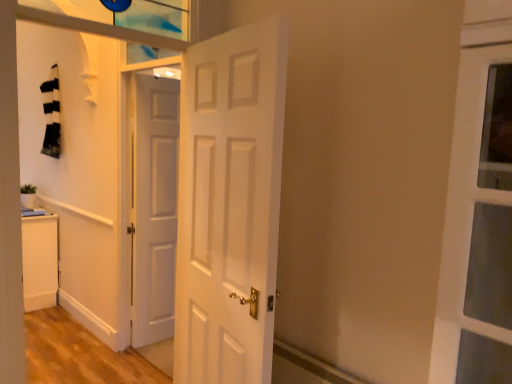
Question: Is white matte door at center, which is the 2th door in right-to-left order, bigger than white matte door at center, which is counted as the 1th door, starting from the front?

Choices:
 (A) yes
 (B) no

Answer: (B)

Question: Considering the relative positions of white matte door at center, the 1th door in the left-to-right sequence, and white matte door at center, the second door in the left-to-right sequence, in the image provided, is white matte door at center, the 1th door in the left-to-right sequence, to the right of white matte door at center, the second door in the left-to-right sequence, from the viewer's perspective?

Choices:
 (A) no
 (B) yes

Answer: (A)

Question: Considering the relative sizes of white matte door at center, the 1th door in the left-to-right sequence, and white matte door at center, the 1th door from the right, in the image provided, is white matte door at center, the 1th door in the left-to-right sequence, taller than white matte door at center, the 1th door from the right,?

Choices:
 (A) no
 (B) yes

Answer: (B)

Question: Is white matte door at center, which appears as the 1th door when viewed from the back, facing away from white matte door at center, the 1th door from the right?

Choices:
 (A) no
 (B) yes

Answer: (A)

Question: Does white matte door at center, which is the 2th door in right-to-left order, have a lesser height compared to white matte door at center, the 1th door from the right?

Choices:
 (A) no
 (B) yes

Answer: (A)

Question: Is white matte door at center, the 1th door from the right, wider or thinner than green matte plant at lower left?

Choices:
 (A) thin
 (B) wide

Answer: (B)

Question: Would you say white matte door at center, acting as the 2th door starting from the back, is inside or outside green matte plant at lower left?

Choices:
 (A) outside
 (B) inside

Answer: (A)

Question: From a real-world perspective, is white matte door at center, the second door in the left-to-right sequence, physically located above or below green matte plant at lower left?

Choices:
 (A) below
 (B) above

Answer: (B)

Question: Considering the positions of white matte door at center, which is counted as the 1th door, starting from the front, and green matte plant at lower left in the image, is white matte door at center, which is counted as the 1th door, starting from the front, taller or shorter than green matte plant at lower left?

Choices:
 (A) short
 (B) tall

Answer: (B)

Question: Considering the positions of white matte cabinet at lower left and white matte door at center, which is counted as the 1th door, starting from the front, in the image, is white matte cabinet at lower left taller or shorter than white matte door at center, which is counted as the 1th door, starting from the front,?

Choices:
 (A) tall
 (B) short

Answer: (B)

Question: From the image's perspective, is white matte cabinet at lower left located above or below white matte door at center, acting as the 2th door starting from the back?

Choices:
 (A) below
 (B) above

Answer: (A)

Question: Considering the positions of white matte cabinet at lower left and white matte door at center, the 1th door from the right, in the image, is white matte cabinet at lower left wider or thinner than white matte door at center, the 1th door from the right,?

Choices:
 (A) thin
 (B) wide

Answer: (B)

Question: In the image, is white matte cabinet at lower left on the left side or the right side of white matte door at center, which is counted as the 1th door, starting from the front?

Choices:
 (A) right
 (B) left

Answer: (B)

Question: In terms of height, does white matte cabinet at lower left look taller or shorter compared to green matte plant at lower left?

Choices:
 (A) tall
 (B) short

Answer: (A)

Question: Would you say white matte cabinet at lower left is to the left or to the right of green matte plant at lower left in the picture?

Choices:
 (A) left
 (B) right

Answer: (A)